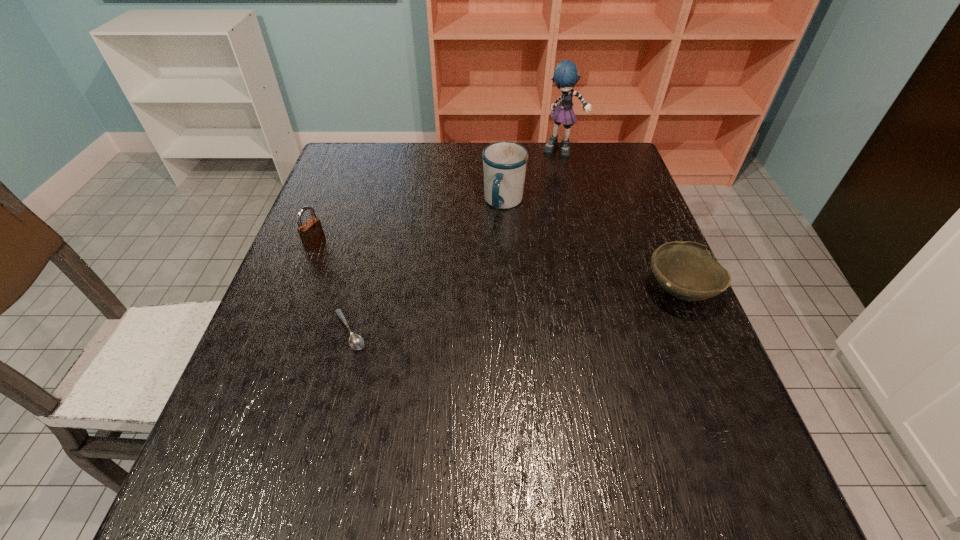
Where is `free space located on the front-facing side of the tallest object`? The image size is (960, 540). free space located on the front-facing side of the tallest object is located at coordinates (555, 232).

This screenshot has height=540, width=960. Find the location of `object situated at the far edge`. object situated at the far edge is located at coordinates (565, 76).

Locate an element on the screen. Image resolution: width=960 pixels, height=540 pixels. soupspoon at the left edge is located at coordinates (356, 342).

I want to click on padlock that is positioned at the left edge, so click(x=311, y=232).

Where is `bowl present at the right edge`? Image resolution: width=960 pixels, height=540 pixels. bowl present at the right edge is located at coordinates (686, 270).

Identify the location of rag doll positioned at the right edge. (565, 76).

Image resolution: width=960 pixels, height=540 pixels. What are the coordinates of `object that is at the far right corner` in the screenshot? It's located at (565, 76).

Where is `vacant space at the far edge of the desktop`? Image resolution: width=960 pixels, height=540 pixels. vacant space at the far edge of the desktop is located at coordinates (481, 177).

This screenshot has width=960, height=540. Find the location of `free location at the near edge`. free location at the near edge is located at coordinates (500, 447).

Identify the location of free spot at the left edge of the desktop. This screenshot has height=540, width=960. (319, 361).